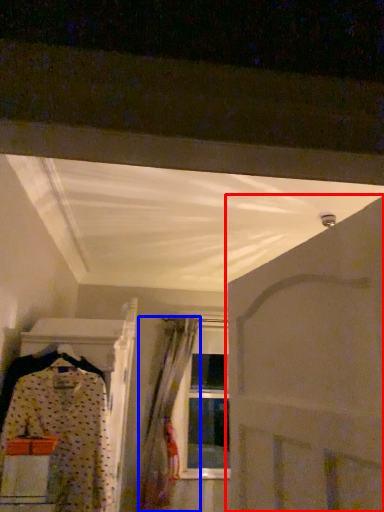
Question: Which object is closer to the camera taking this photo, door (highlighted by a red box) or curtain (highlighted by a blue box)?

Choices:
 (A) door
 (B) curtain

Answer: (A)